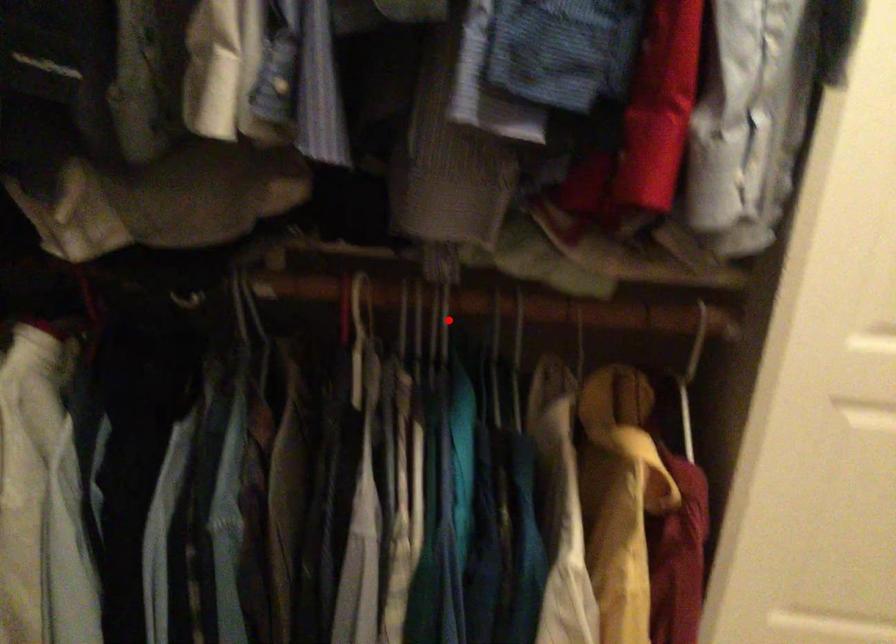
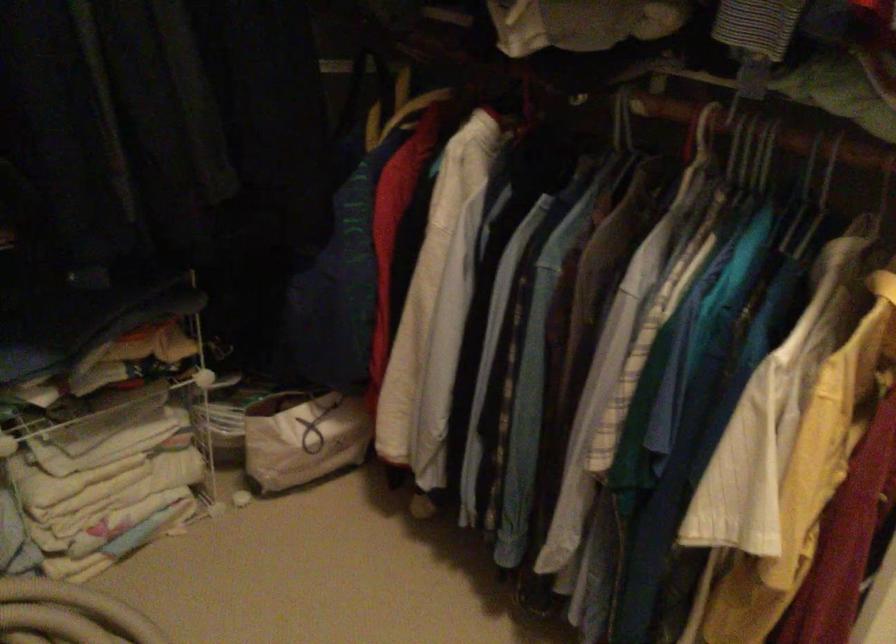
Question: I am providing you with two images of the same scene from different viewpoints. A red point is shown in image1. For the corresponding object point in image2, is it positioned nearer or farther from the camera?

Choices:
 (A) Nearer
 (B) Farther

Answer: (B)